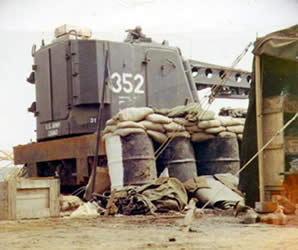
The width and height of the screenshot is (298, 250). I want to click on fabric, so click(x=171, y=196), click(x=220, y=202), click(x=227, y=177).